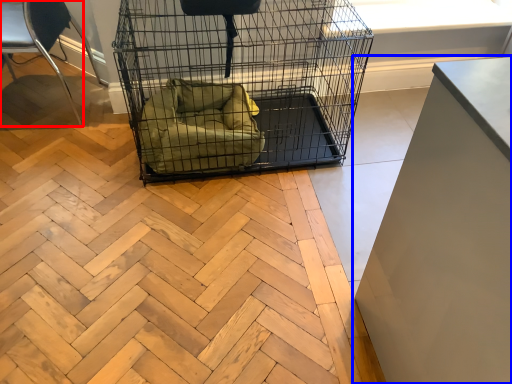
Question: Among these objects, which one is farthest to the camera, chair (highlighted by a red box) or furniture (highlighted by a blue box)?

Choices:
 (A) chair
 (B) furniture

Answer: (A)